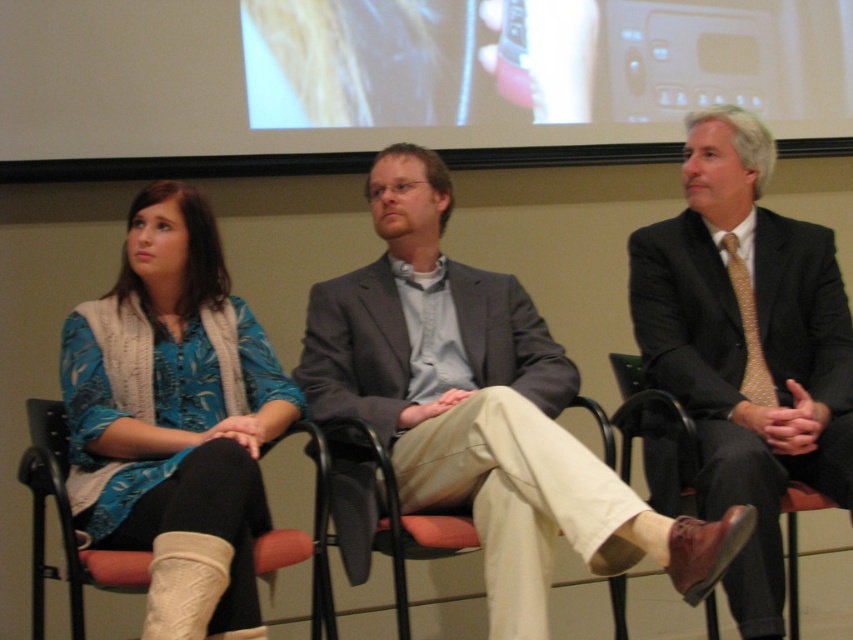
You are a photographer taking a photo of the three people seated in the formal setting. The camera is positioned at the front, facing the group. To ensure the gray suit at center is centered in the frame, where should you adjust the camera? Please provide the coordinates as a point between 0 and 1 in both x and y axes.

The gray suit at center is located at point coordinates of 0.639 in the x axis and 0.566 in the y axis. To center the gray suit at center in the frame, the camera should be adjusted to focus on those coordinates.

You are attending a panel discussion and need to sit down. You see a gray suit at center and a fabric cushioned chair at lower left. Which one is closer to the left side of the room?

The fabric cushioned chair at lower left is closer to the left side of the room because it is positioned to the left of the gray suit at center.